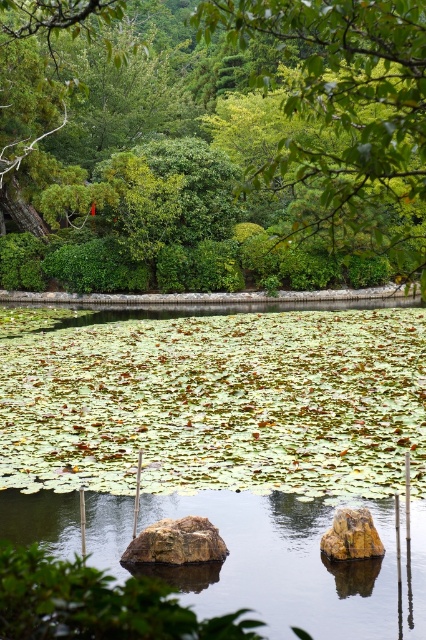
Question: Can you confirm if translucent water at center is positioned above brown rough rock at center?

Choices:
 (A) no
 (B) yes

Answer: (A)

Question: Among these objects, which one is farthest from the camera?

Choices:
 (A) green leafy tree at center
 (B) brown rough rock at center

Answer: (B)

Question: Which point is closer to the camera taking this photo?

Choices:
 (A) (201, 602)
 (B) (310, 26)
 (C) (363, 556)

Answer: (B)

Question: Observing the image, what is the correct spatial positioning of green leafy tree at center in reference to translucent water at center?

Choices:
 (A) left
 (B) right

Answer: (A)

Question: Based on their relative distances, which object is farther from the green leafy tree at center?

Choices:
 (A) rusty metallic boulder at center
 (B) brown rough rock at center
 (C) translucent water at center

Answer: (C)

Question: Is brown rough rock at center in front of rusty metallic boulder at center?

Choices:
 (A) yes
 (B) no

Answer: (B)